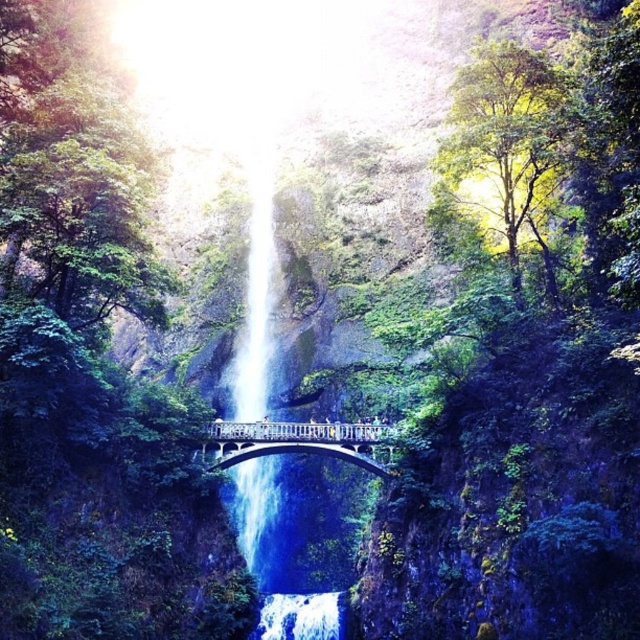
You are a hiker who wants to cross the white stone bridge at center to reach the other side of the cliff. However, you notice the white frothy water at center nearby. Is the water in front of or behind the bridge from your perspective?

The white frothy water at center is behind the white stone bridge at center, so from your perspective as a hiker trying to cross the bridge, the water is located behind the bridge.

You are standing at the base of the waterfall and want to cross to the other side using the white stone bridge at center. Given that the bridge is positioned at coordinates approximately 0.691 along the horizontal axis and 0.461 along the vertical axis, can you estimate its location relative to your current position?

The white stone bridge at center is located at coordinates approximately 0.691 along the horizontal axis and 0.461 along the vertical axis, meaning it is positioned to the right and slightly below your current position at the base of the waterfall.

You are planning to cross the white stone bridge at center to reach the other side of the waterfall. However, you notice the clear blue water at center is flowing strongly. Based on the size comparison between the two, which one do you think has a greater volume of water?

The clear blue water at center is bigger than the white stone bridge at center, so it likely has a greater volume of water flowing through it.